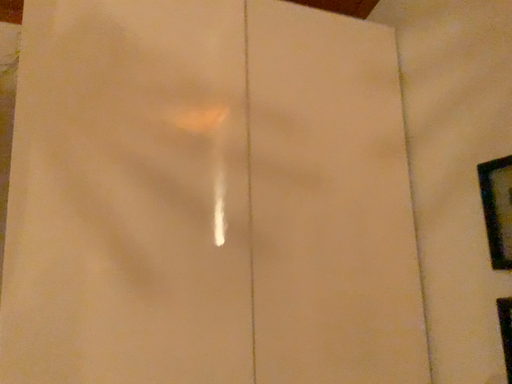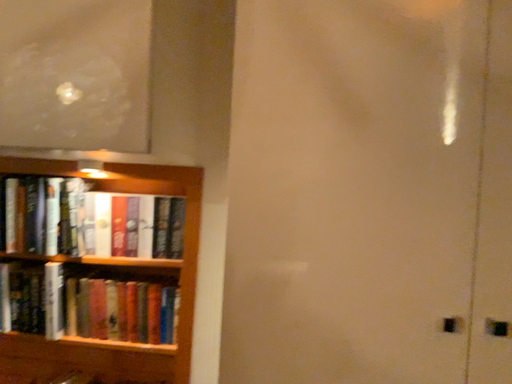
Question: How did the camera likely rotate when shooting the video?

Choices:
 (A) rotated upward
 (B) rotated downward

Answer: (B)